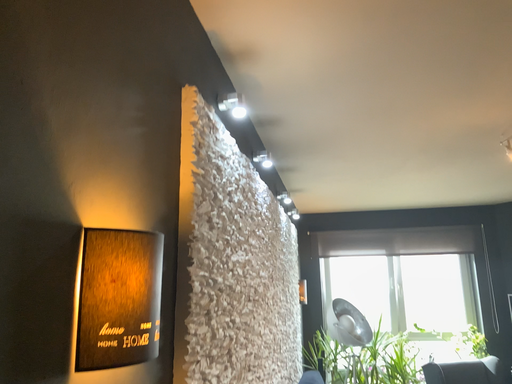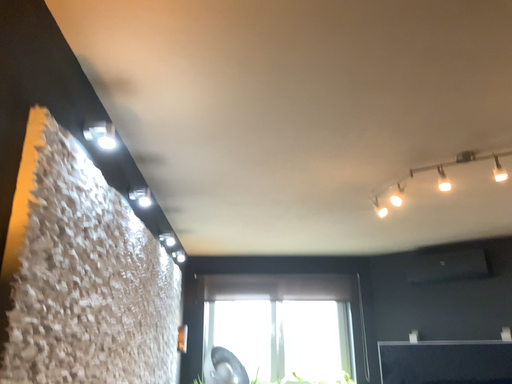
Question: Which way did the camera rotate in the video?

Choices:
 (A) rotated left
 (B) rotated right

Answer: (B)